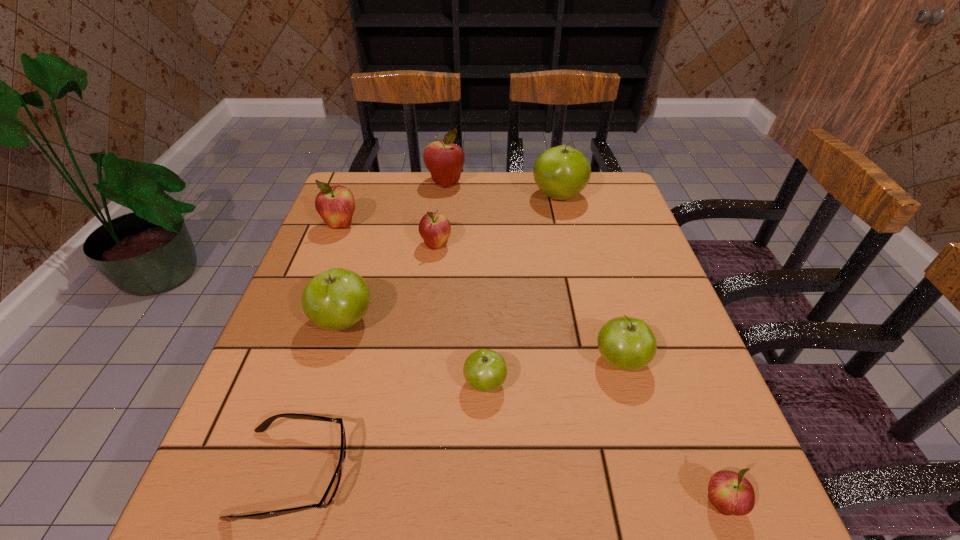
I want to click on the biggest red apple, so click(444, 160).

Locate an element on the screen. This screenshot has height=540, width=960. the biggest green apple is located at coordinates (562, 172).

Locate an element on the screen. This screenshot has width=960, height=540. the third smallest red apple is located at coordinates (335, 204).

I want to click on the leftmost green apple, so click(x=336, y=299).

You are a GUI agent. You are given a task and a screenshot of the screen. Output one action in this format:
    pyautogui.click(x=<x>, y=<y>)
    Task: Click on the third biggest red apple
    Image resolution: width=960 pixels, height=540 pixels.
    Given the screenshot: What is the action you would take?
    pyautogui.click(x=434, y=228)

Where is `the second smallest green apple`? The height and width of the screenshot is (540, 960). the second smallest green apple is located at coordinates (626, 343).

Find the location of a particular element. The image size is (960, 540). the smallest green apple is located at coordinates (485, 370).

At what (x,y) coordinates should I click in order to perform the action: click on the third green apple from right to left. Please return your answer as a coordinate pair (x, y). The image size is (960, 540). Looking at the image, I should click on (485, 370).

This screenshot has width=960, height=540. I want to click on the nearest apple, so click(x=730, y=493).

Identify the location of the rightmost object. (730, 493).